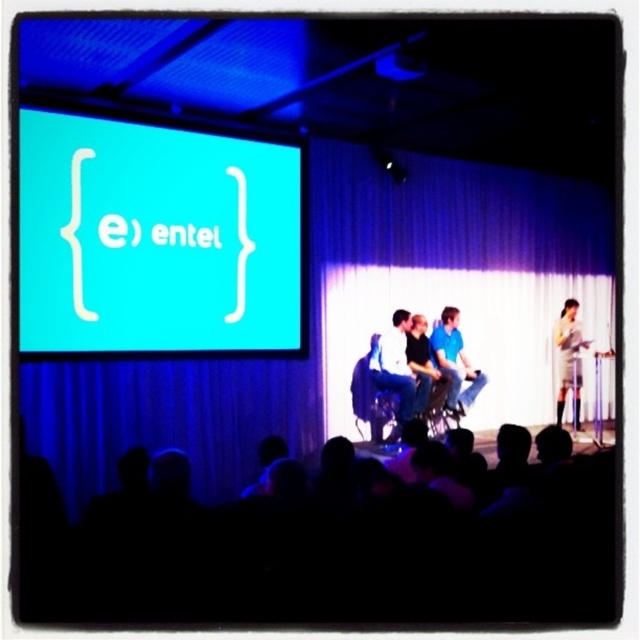
You are an event planner setting up a new projector for the stage. The projector has a lens that can only focus on objects within a 0.25 unit radius from its center point at coordinates. What is the closest distance between the projector lens and the teal matte projection screen at upper left to ensure proper focus?

The closest distance between the projector lens and the teal matte projection screen at upper left is 0.244 units vertically. Since the screen is within the 0.25 unit radius, the projector can focus properly.

You are a stagehand who needs to place a 3.5 meter long extension cord from the teal matte projection screen at upper left to the white dress at right. Will the cord be long enough to reach without needing to extend it further?

The teal matte projection screen at upper left and white dress at right are 4.20 meters apart from each other. The extension cord is 3.5 meters long, which is shorter than the distance between them. Therefore, the cord will not be long enough to reach without extending it further.

Looking at this image, you are an event organizer arranging a photo shoot for the panel discussion. You need to position a spotlight on the stage so it shines directly on the matte white shirt at center and the blue fabric chair at center. Based on their positions, which object should the spotlight be placed closer to? Explain your reasoning using their spatial relationship.

The spotlight should be placed closer to the blue fabric chair at center because the matte white shirt at center is to the left of the blue fabric chair at center. Since the shirt is positioned to the left, the chair is further to the right, so the spotlight needs to be closer to the chair to effectively illuminate both objects without casting shadows.